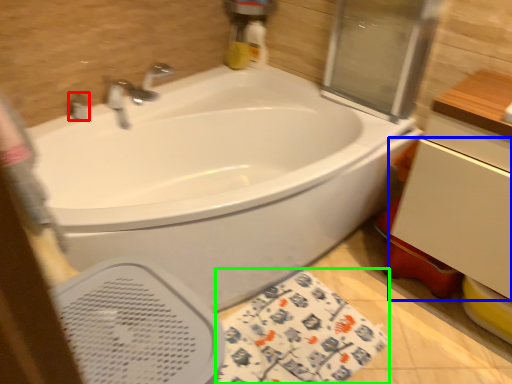
Question: Which is farther away from plumbing fixture (highlighted by a red box)? drawer (highlighted by a blue box) or beach towel (highlighted by a green box)?

Choices:
 (A) drawer
 (B) beach towel

Answer: (A)